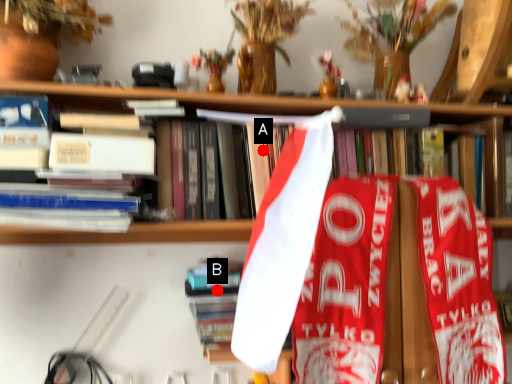
Question: Two points are circled on the image, labeled by A and B beside each circle. Which point is further to the camera?

Choices:
 (A) A is further
 (B) B is further

Answer: (B)